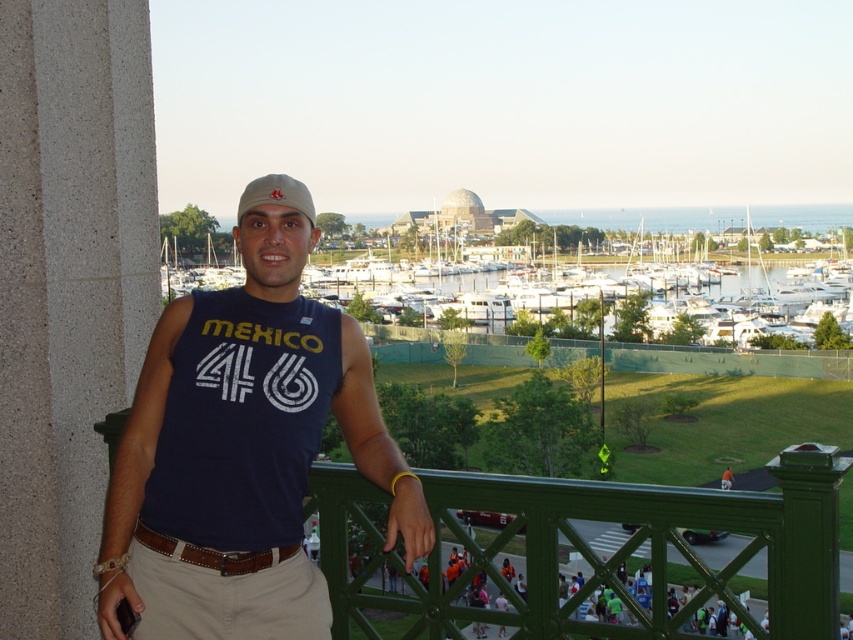
Which is more to the left, matte blue tank top at center or matte beige cap at center?

matte beige cap at center is more to the left.

Can you confirm if matte blue tank top at center is positioned to the right of matte beige cap at center?

Yes, matte blue tank top at center is to the right of matte beige cap at center.

Does point (355, 349) come farther from viewer compared to point (289, 182)?

Yes, it is behind point (289, 182).

Where is `matte blue tank top at center`? matte blue tank top at center is located at coordinates (242, 452).